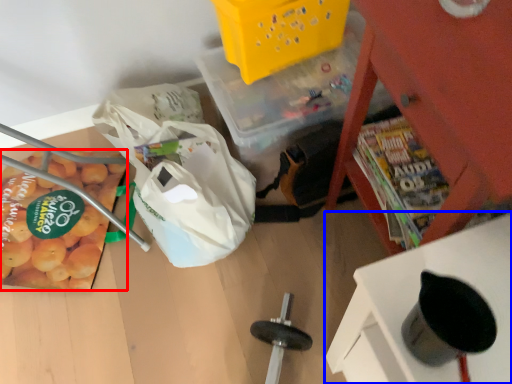
Question: Among these objects, which one is nearest to the camera, vegetable (highlighted by a red box) or furniture (highlighted by a blue box)?

Choices:
 (A) vegetable
 (B) furniture

Answer: (B)